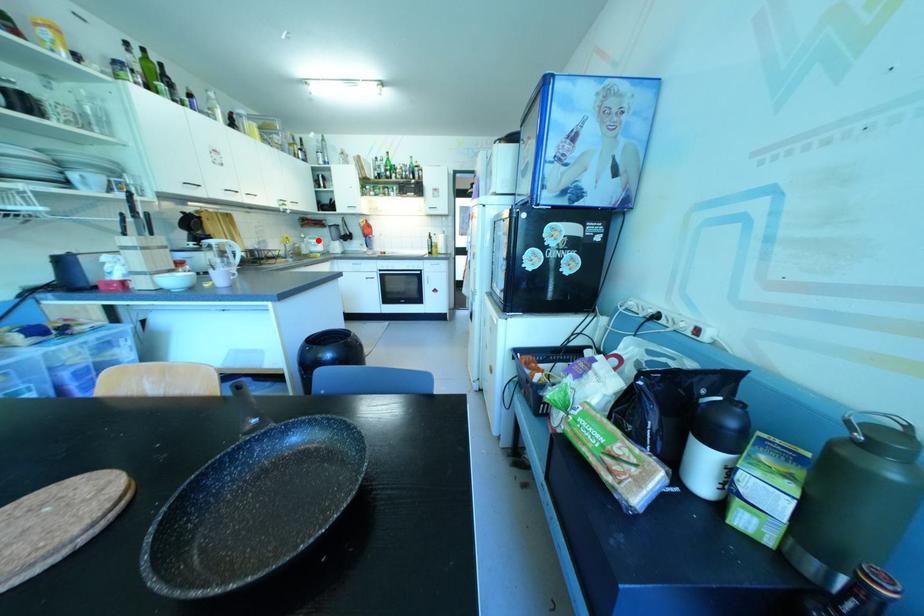
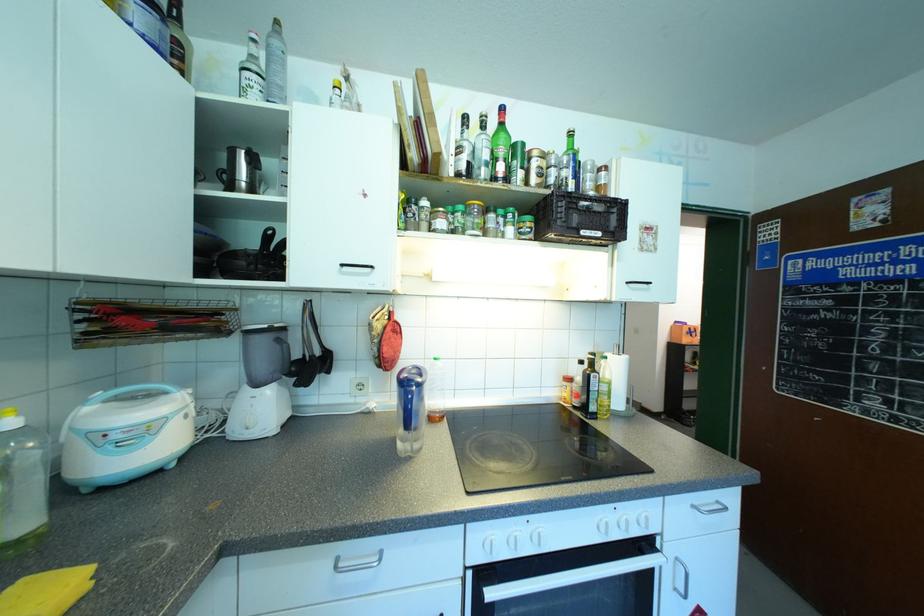
Locate, in the second image, the point that corresponds to the highlighted location in the first image.

(172, 403)